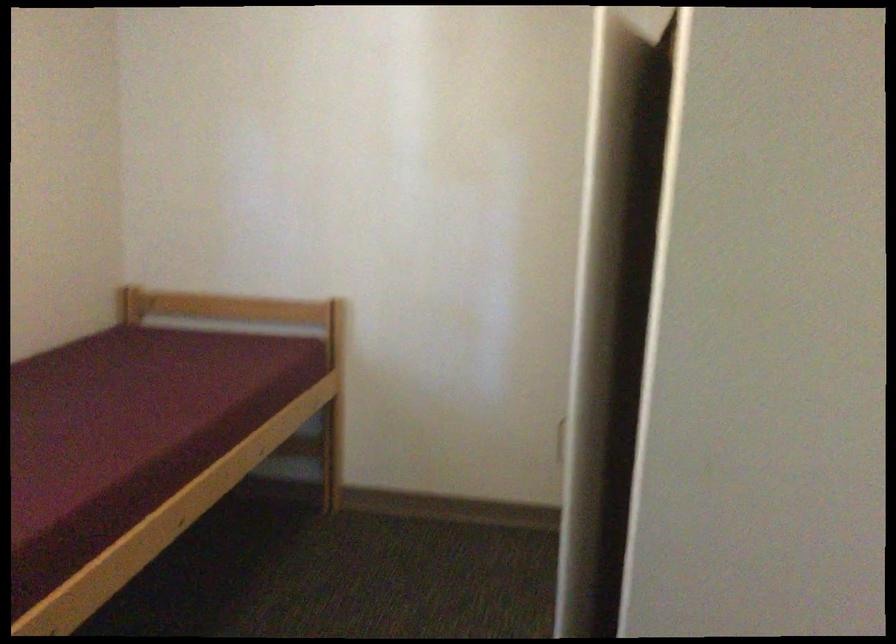
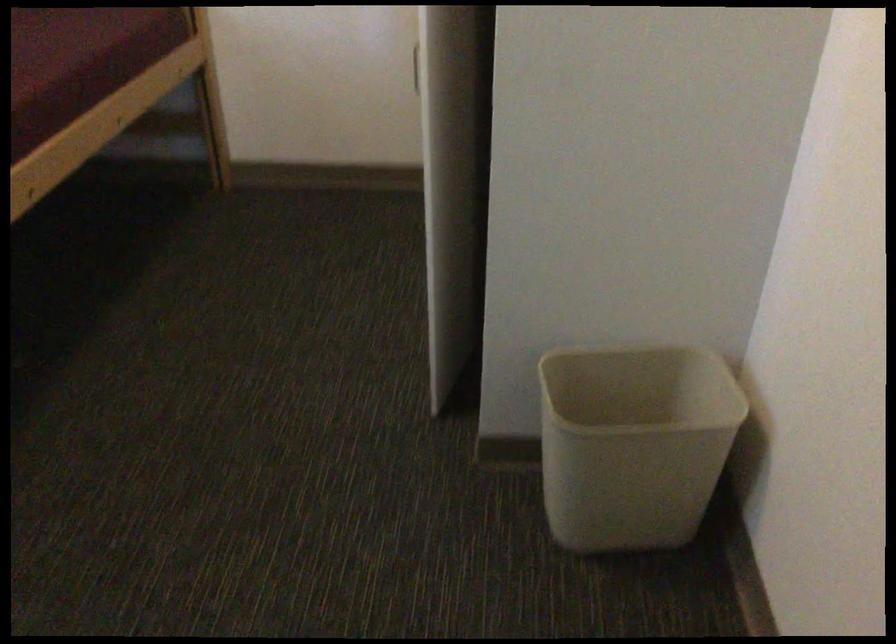
Question: The images are taken continuously from a first-person perspective. In which direction is your viewpoint rotating?

Choices:
 (A) Left
 (B) Right
 (C) Up
 (D) Down

Answer: (D)